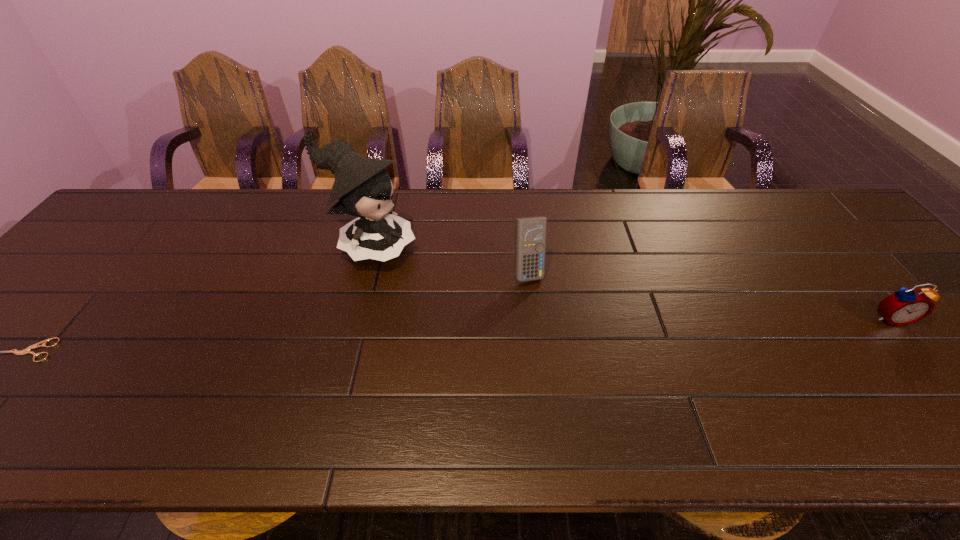
At what (x,y) coordinates should I click in order to perform the action: click on free space between the second tallest object and the alarm clock. Please return your answer as a coordinate pair (x, y). Image resolution: width=960 pixels, height=540 pixels. Looking at the image, I should click on (709, 295).

The height and width of the screenshot is (540, 960). I want to click on vacant point located between the tallest object and the calculator, so click(x=449, y=260).

Locate an element on the screen. Image resolution: width=960 pixels, height=540 pixels. free area in between the tallest object and the second object from right to left is located at coordinates (449, 260).

Identify the location of vacant space in between the third tallest object and the third object from right to left. This screenshot has height=540, width=960. (630, 284).

What are the coordinates of `vacant region between the tallest object and the third farthest object` in the screenshot? It's located at (630, 284).

The height and width of the screenshot is (540, 960). I want to click on vacant space in between the third object from right to left and the third tallest object, so click(x=630, y=284).

This screenshot has width=960, height=540. What are the coordinates of `the second closest object relative to the nearest object` in the screenshot? It's located at (x=530, y=233).

The height and width of the screenshot is (540, 960). Identify the location of object identified as the third closest to the shortest object. (905, 306).

Where is `free region that satisfies the following two spatial constraints: 1. on the front side of the calculator; 2. on the right side of the doll`? free region that satisfies the following two spatial constraints: 1. on the front side of the calculator; 2. on the right side of the doll is located at coordinates (363, 272).